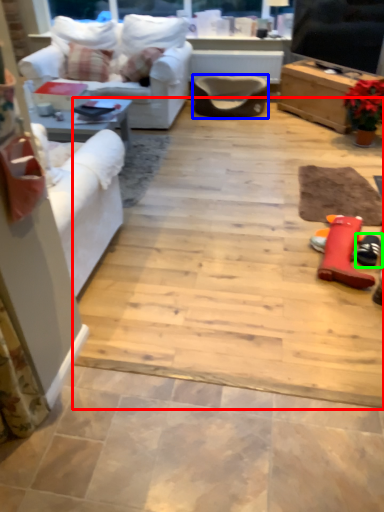
Question: Based on their relative distances, which object is nearer to ceramic tile (highlighted by a red box)? Choose from armchair (highlighted by a blue box) and footwear (highlighted by a green box).

Choices:
 (A) armchair
 (B) footwear

Answer: (B)